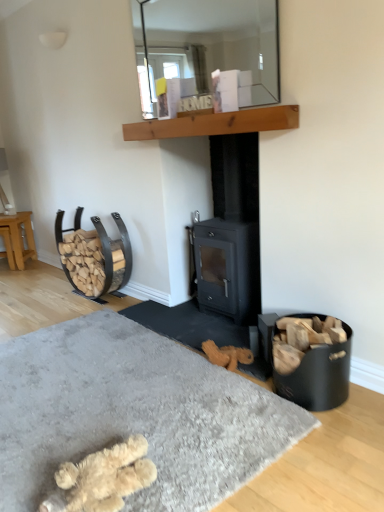
This screenshot has height=512, width=384. What are the coordinates of `free space behind fuzzy beige slippers at lower left` in the screenshot? It's located at (127, 423).